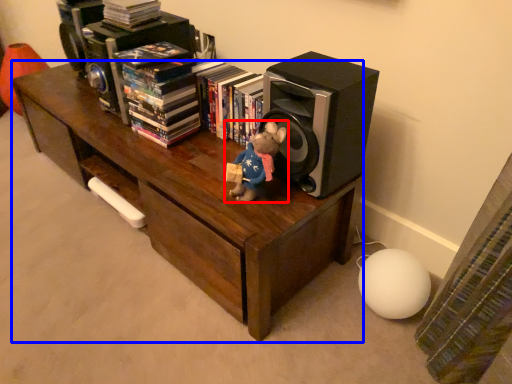
Question: Among these objects, which one is farthest to the camera, toy (highlighted by a red box) or table (highlighted by a blue box)?

Choices:
 (A) toy
 (B) table

Answer: (B)